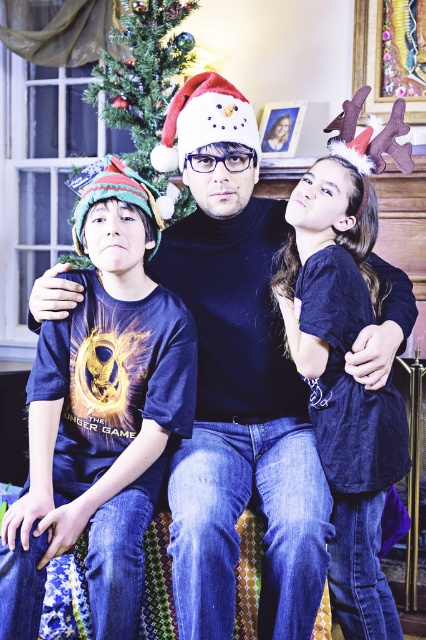
Question: Which object is positioned closest to the snowman fabric hat at center?

Choices:
 (A) green matte christmas tree at upper left
 (B) blue cotton shirt at left

Answer: (B)

Question: Is the position of green matte christmas tree at upper left less distant than that of snowman fabric hat at center?

Choices:
 (A) yes
 (B) no

Answer: (B)

Question: Which of the following is the farthest from the observer?

Choices:
 (A) green matte christmas tree at upper left
 (B) dark blue velvet shirt at upper right
 (C) snowman fabric hat at center
 (D) blue cotton shirt at left

Answer: (A)

Question: Among these points, which one is nearest to the camera?

Choices:
 (A) (333, 419)
 (B) (17, 532)

Answer: (B)

Question: Is dark blue velvet shirt at upper right below snowman fabric hat at center?

Choices:
 (A) no
 (B) yes

Answer: (B)

Question: Considering the relative positions of blue cotton shirt at left and green matte christmas tree at upper left in the image provided, where is blue cotton shirt at left located with respect to green matte christmas tree at upper left?

Choices:
 (A) left
 (B) right

Answer: (B)